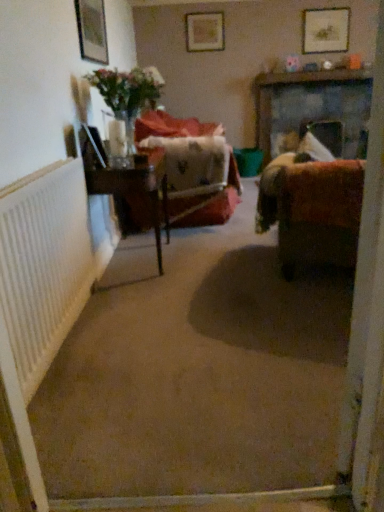
Question: Is translucent glass vase at upper left directly adjacent to wooden picture frame at upper right, marked as the third picture frame in a bottom-to-top arrangement?

Choices:
 (A) no
 (B) yes

Answer: (A)

Question: Is translucent glass vase at upper left positioned in front of wooden picture frame at upper right, which is counted as the first picture frame, starting from the right?

Choices:
 (A) no
 (B) yes

Answer: (B)

Question: From a real-world perspective, is translucent glass vase at upper left positioned under wooden picture frame at upper right, which appears as the 2th picture frame when viewed from the back, based on gravity?

Choices:
 (A) yes
 (B) no

Answer: (A)

Question: Is translucent glass vase at upper left at the left side of wooden picture frame at upper right, marked as the third picture frame in a bottom-to-top arrangement?

Choices:
 (A) no
 (B) yes

Answer: (B)

Question: Is translucent glass vase at upper left positioned with its back to wooden picture frame at upper right, which is counted as the first picture frame, starting from the right?

Choices:
 (A) yes
 (B) no

Answer: (B)

Question: From a real-world perspective, relative to wooden table at center, is velvet brown couch at right vertically above or below?

Choices:
 (A) above
 (B) below

Answer: (A)

Question: In terms of height, does velvet brown couch at right look taller or shorter compared to wooden table at center?

Choices:
 (A) tall
 (B) short

Answer: (A)

Question: Relative to wooden table at center, is velvet brown couch at right in front or behind?

Choices:
 (A) behind
 (B) front

Answer: (B)

Question: Considering the positions of velvet brown couch at right and wooden table at center in the image, is velvet brown couch at right wider or thinner than wooden table at center?

Choices:
 (A) thin
 (B) wide

Answer: (B)

Question: In the image, is wooden picture frame at upper right, which ranks as the second picture frame in front-to-back order, on the left side or the right side of translucent glass vase at left?

Choices:
 (A) right
 (B) left

Answer: (A)

Question: Is wooden picture frame at upper right, the first picture frame positioned from the top, wider or thinner than translucent glass vase at left?

Choices:
 (A) wide
 (B) thin

Answer: (B)

Question: From a real-world perspective, is wooden picture frame at upper right, the first picture frame positioned from the top, physically located above or below translucent glass vase at left?

Choices:
 (A) above
 (B) below

Answer: (A)

Question: Is point (344, 47) closer or farther from the camera than point (134, 146)?

Choices:
 (A) closer
 (B) farther

Answer: (B)

Question: In terms of height, does matte wooden picture frame at upper left, which ranks as the 3th picture frame in top-to-bottom order, look taller or shorter compared to white textured radiator at left?

Choices:
 (A) tall
 (B) short

Answer: (B)

Question: Looking at the image, does matte wooden picture frame at upper left, which is counted as the 1th picture frame, starting from the front, seem bigger or smaller compared to white textured radiator at left?

Choices:
 (A) big
 (B) small

Answer: (B)